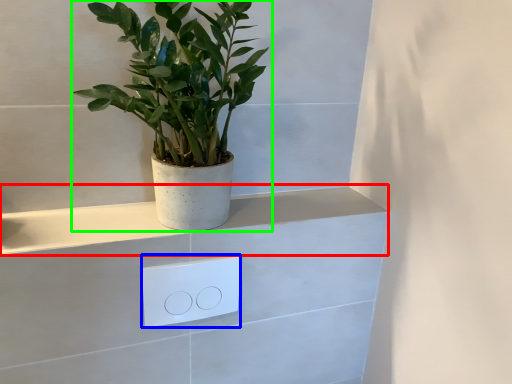
Question: Estimate the real-world distances between objects in this image. Which object is farther from ledge (highlighted by a red box), light switch (highlighted by a blue box) or houseplant (highlighted by a green box)?

Choices:
 (A) light switch
 (B) houseplant

Answer: (B)